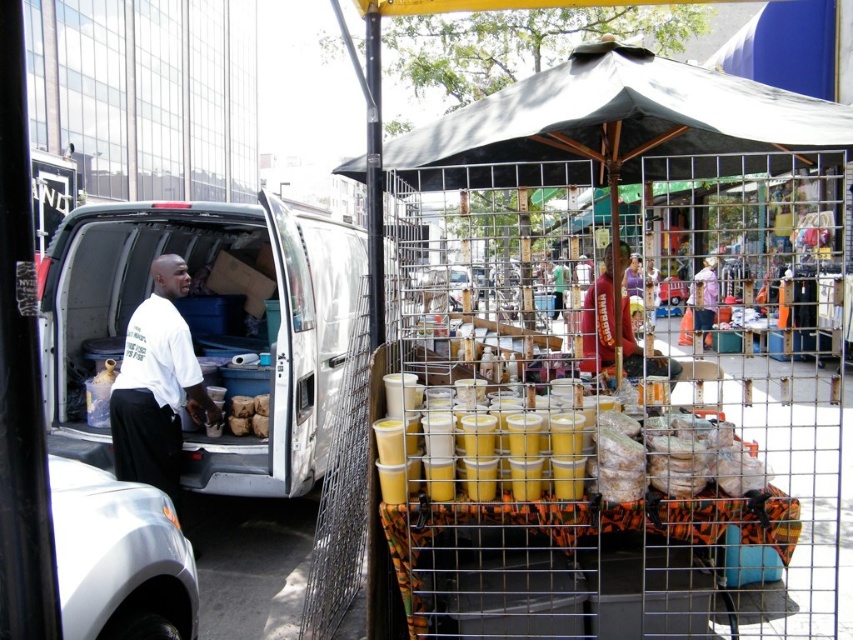
Which of these two, yellow matte cups at center or white matte shirt at left, stands shorter?

Standing shorter between the two is yellow matte cups at center.

Consider the image. Is yellow matte cups at center bigger than white matte shirt at left?

Correct, yellow matte cups at center is larger in size than white matte shirt at left.

Identify the location of yellow matte cups at center. click(566, 451).

Identify the location of yellow matte cups at center. (566, 451).

Can you confirm if white matte van at left is positioned above white matte shirt at left?

Indeed, white matte van at left is positioned over white matte shirt at left.

Can you confirm if white matte van at left is positioned below white matte shirt at left?

Actually, white matte van at left is above white matte shirt at left.

Between point (119, 296) and point (161, 342), which one is positioned behind?

Point (119, 296)

Identify the location of white matte van at left. Image resolution: width=853 pixels, height=640 pixels. (209, 324).

Between white matte van at left and yellow matte cups at center, which one appears on the left side from the viewer's perspective?

white matte van at left is more to the left.

Does white matte van at left have a lesser height compared to yellow matte cups at center?

No.

Between point (55, 360) and point (583, 484), which one is positioned behind?

The point (55, 360) is behind.

Locate an element on the screen. Image resolution: width=853 pixels, height=640 pixels. white matte van at left is located at coordinates (209, 324).